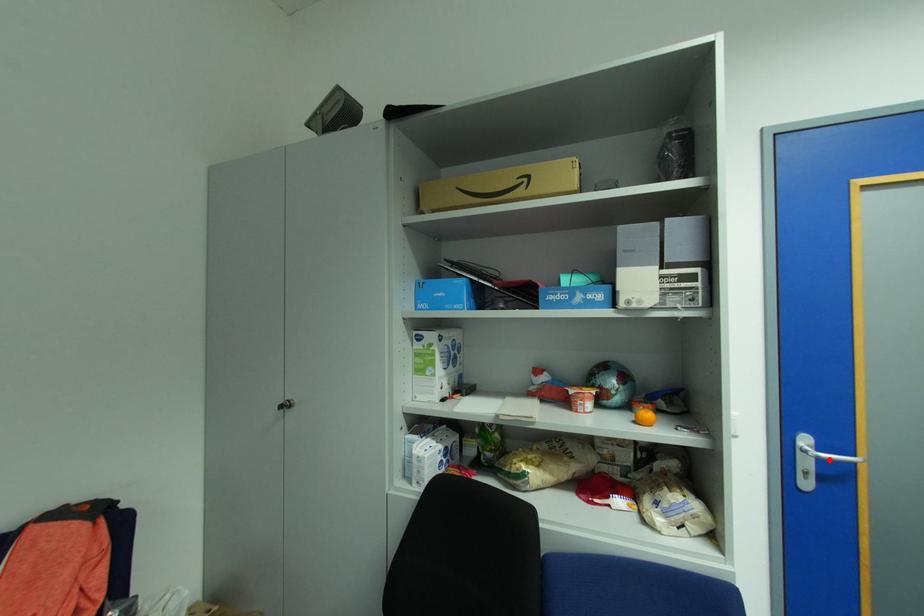
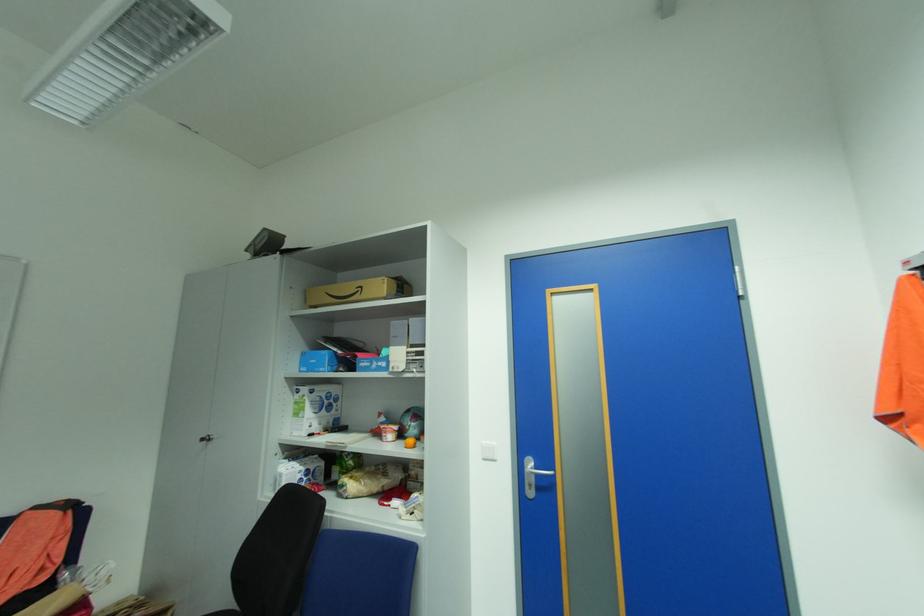
Locate, in the second image, the point that corresponds to the highlighted location in the first image.

(543, 475)